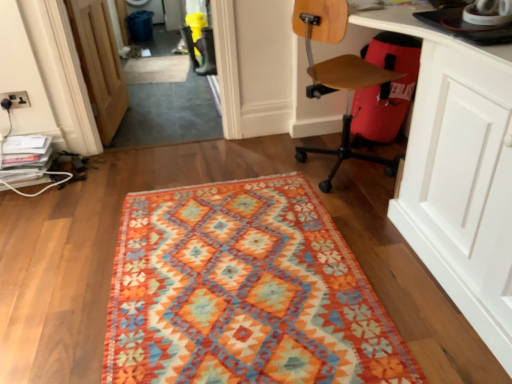
Question: Is white glossy computer desk at lower right oriented towards textured woolen rug at center?

Choices:
 (A) no
 (B) yes

Answer: (B)

Question: Is white glossy computer desk at lower right far away from textured woolen rug at center?

Choices:
 (A) no
 (B) yes

Answer: (A)

Question: Is white glossy computer desk at lower right bigger than textured woolen rug at center?

Choices:
 (A) yes
 (B) no

Answer: (A)

Question: From the image's perspective, would you say white glossy computer desk at lower right is positioned over textured woolen rug at center?

Choices:
 (A) yes
 (B) no

Answer: (A)

Question: Is white glossy computer desk at lower right further to camera compared to textured woolen rug at center?

Choices:
 (A) no
 (B) yes

Answer: (A)

Question: Choose the correct answer: Is beige carpet at center inside textured woolen rug at center or outside it?

Choices:
 (A) inside
 (B) outside

Answer: (B)

Question: From the image's perspective, is beige carpet at center positioned above or below textured woolen rug at center?

Choices:
 (A) below
 (B) above

Answer: (B)

Question: From a real-world perspective, is beige carpet at center above or below textured woolen rug at center?

Choices:
 (A) below
 (B) above

Answer: (A)

Question: Based on their positions, is beige carpet at center located to the left or right of textured woolen rug at center?

Choices:
 (A) right
 (B) left

Answer: (B)

Question: From the image's perspective, is matte black electric outlet at upper left positioned above or below wooden at right?

Choices:
 (A) above
 (B) below

Answer: (B)

Question: In the image, is matte black electric outlet at upper left positioned in front of or behind wooden at right?

Choices:
 (A) behind
 (B) front

Answer: (A)

Question: From a real-world perspective, is matte black electric outlet at upper left physically located above or below wooden at right?

Choices:
 (A) above
 (B) below

Answer: (B)

Question: Is matte black electric outlet at upper left taller or shorter than wooden at right?

Choices:
 (A) tall
 (B) short

Answer: (B)

Question: Is point (135, 67) positioned closer to the camera than point (479, 317)?

Choices:
 (A) farther
 (B) closer

Answer: (A)

Question: Is beige carpet at center wider or thinner than white glossy computer desk at lower right?

Choices:
 (A) wide
 (B) thin

Answer: (A)